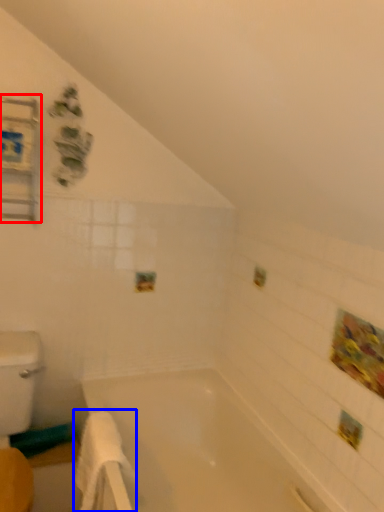
Question: Which object is further to the camera taking this photo, medicine cabinet (highlighted by a red box) or bath towel (highlighted by a blue box)?

Choices:
 (A) medicine cabinet
 (B) bath towel

Answer: (A)